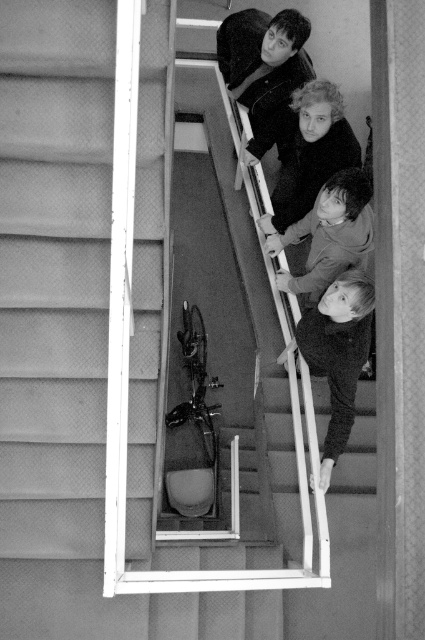
Question: Which of the following is the closest to the observer?

Choices:
 (A) (289, 90)
 (B) (320, 346)
 (C) (354, 172)

Answer: (C)

Question: Which of these objects is positioned farthest from the smooth black shirt at lower right?

Choices:
 (A) dark gray sweater at center
 (B) smooth black shirt at upper center
 (C) smooth skin child at upper center

Answer: (B)

Question: Does smooth skin child at upper center have a smaller size compared to dark gray sweater at center?

Choices:
 (A) no
 (B) yes

Answer: (A)

Question: Does smooth black shirt at upper center have a larger size compared to smooth black shirt at lower right?

Choices:
 (A) no
 (B) yes

Answer: (B)

Question: Does smooth black shirt at upper center appear on the left side of smooth black shirt at lower right?

Choices:
 (A) yes
 (B) no

Answer: (A)

Question: Which object appears farthest from the camera in this image?

Choices:
 (A) smooth black shirt at upper center
 (B) smooth black shirt at lower right
 (C) dark gray sweater at center
 (D) smooth skin child at upper center

Answer: (A)